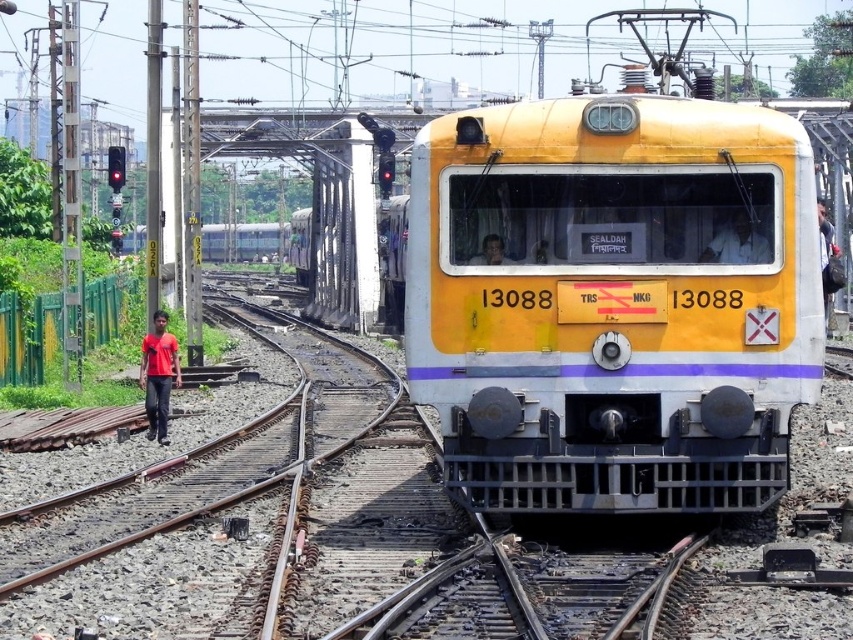
Is red matte shirt at left to the right of matte black face at center from the viewer's perspective?

In fact, red matte shirt at left is to the left of matte black face at center.

Is red matte shirt at left bigger than matte black face at center?

Indeed, red matte shirt at left has a larger size compared to matte black face at center.

The height and width of the screenshot is (640, 853). What do you see at coordinates (158, 376) in the screenshot?
I see `red matte shirt at left` at bounding box center [158, 376].

At what (x,y) coordinates should I click in order to perform the action: click on red matte shirt at left. Please return your answer as a coordinate pair (x, y). Looking at the image, I should click on (158, 376).

Who is more forward, (143, 356) or (740, 221)?

Point (740, 221) is more forward.

Between point (160, 394) and point (737, 216), which one is positioned behind?

Point (160, 394)

Who is more distant from viewer, [158,412] or [741,246]?

Point [158,412]

What are the coordinates of `red matte shirt at left` in the screenshot? It's located at (158, 376).

Which is above, white fabric shirt at center or matte black face at center?

white fabric shirt at center

The height and width of the screenshot is (640, 853). What do you see at coordinates (737, 243) in the screenshot?
I see `white fabric shirt at center` at bounding box center [737, 243].

Find the location of a particular element. white fabric shirt at center is located at coordinates (737, 243).

I want to click on white fabric shirt at center, so coord(737,243).